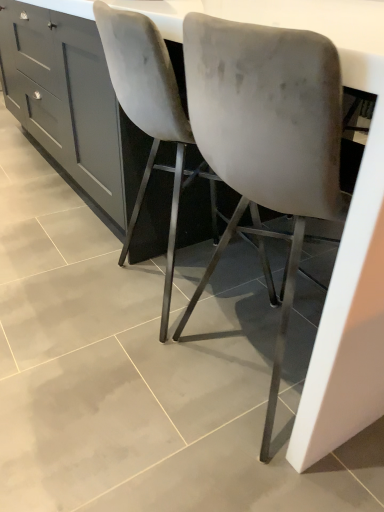
Question: In terms of size, does white glossy counter at center appear bigger or smaller than velvet-like gray chair at center, the 1th chair when ordered from left to right?

Choices:
 (A) small
 (B) big

Answer: (B)

Question: Is point (198, 5) positioned closer to the camera than point (157, 124)?

Choices:
 (A) closer
 (B) farther

Answer: (A)

Question: Which of these objects is positioned closest to the matte gray cabinet at center?

Choices:
 (A) velvet-like gray chair at center, which ranks as the 2th chair in right-to-left order
 (B) velvet grey chair at center, which ranks as the first chair in right-to-left order
 (C) white glossy counter at center

Answer: (A)

Question: Based on their relative distances, which object is nearer to the white glossy counter at center?

Choices:
 (A) velvet-like gray chair at center, which ranks as the 2th chair in right-to-left order
 (B) matte gray cabinet at center
 (C) velvet grey chair at center, which ranks as the first chair in right-to-left order

Answer: (C)